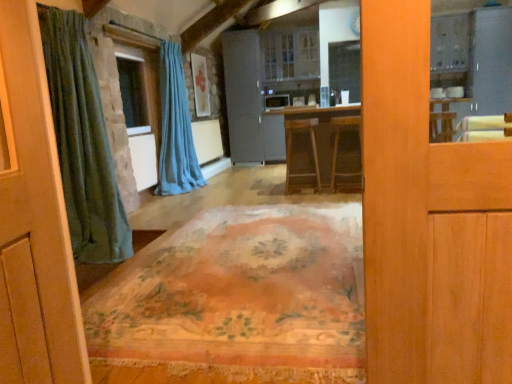
Question: Is the position of white glossy cabinet at upper right, the 1th screen door viewed from the right, less distant than that of stone window at center?

Choices:
 (A) no
 (B) yes

Answer: (A)

Question: Does white glossy cabinet at upper right, the 1th screen door viewed from the right, appear on the right side of stone window at center?

Choices:
 (A) yes
 (B) no

Answer: (A)

Question: From a real-world perspective, is white glossy cabinet at upper right, the 1th screen door viewed from the right, over stone window at center?

Choices:
 (A) no
 (B) yes

Answer: (B)

Question: Considering the relative sizes of white glossy cabinet at upper right, which is the second screen door in left-to-right order, and stone window at center in the image provided, is white glossy cabinet at upper right, which is the second screen door in left-to-right order, bigger than stone window at center?

Choices:
 (A) no
 (B) yes

Answer: (B)

Question: Is white glossy cabinet at upper right, the 1th screen door viewed from the right, to the left of stone window at center from the viewer's perspective?

Choices:
 (A) no
 (B) yes

Answer: (A)

Question: From the image's perspective, is satin gray refrigerator at center, the second screen door when ordered from right to left, above or below satin gray refrigerator at center?

Choices:
 (A) above
 (B) below

Answer: (A)

Question: Is satin gray refrigerator at center, the 1th screen door from the left, in front of or behind satin gray refrigerator at center in the image?

Choices:
 (A) behind
 (B) front

Answer: (B)

Question: Considering the positions of satin gray refrigerator at center, the second screen door when ordered from right to left, and satin gray refrigerator at center in the image, is satin gray refrigerator at center, the second screen door when ordered from right to left, wider or thinner than satin gray refrigerator at center?

Choices:
 (A) thin
 (B) wide

Answer: (B)

Question: Is point (238, 46) positioned closer to the camera than point (268, 104)?

Choices:
 (A) farther
 (B) closer

Answer: (A)

Question: From a real-world perspective, is stone window at center physically located above or below wooden stool at center, which is counted as the 2th furniture, starting from the right?

Choices:
 (A) above
 (B) below

Answer: (A)

Question: Is stone window at center in front of or behind wooden stool at center, which appears as the first furniture when viewed from the left, in the image?

Choices:
 (A) front
 (B) behind

Answer: (A)

Question: Would you say stone window at center is to the left or to the right of wooden stool at center, which is counted as the 2th furniture, starting from the right, in the picture?

Choices:
 (A) left
 (B) right

Answer: (A)

Question: Is stone window at center taller or shorter than wooden stool at center, which appears as the first furniture when viewed from the left?

Choices:
 (A) tall
 (B) short

Answer: (A)

Question: Considering the positions of wooden stool at center, which is counted as the 2th furniture, starting from the right, and wooden stool at center, marked as the 1th furniture in a right-to-left arrangement, in the image, is wooden stool at center, which is counted as the 2th furniture, starting from the right, taller or shorter than wooden stool at center, marked as the 1th furniture in a right-to-left arrangement,?

Choices:
 (A) short
 (B) tall

Answer: (B)

Question: Is wooden stool at center, which appears as the first furniture when viewed from the left, wider or thinner than wooden stool at center, the 2th furniture viewed from the left?

Choices:
 (A) wide
 (B) thin

Answer: (A)